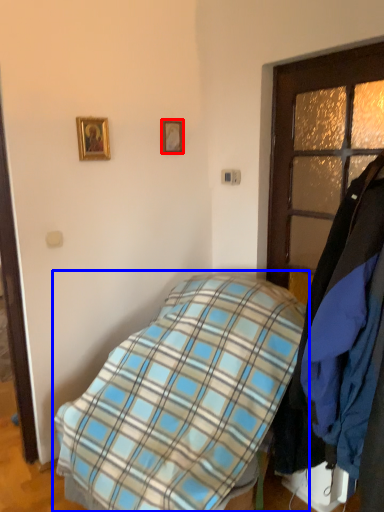
Question: Which object appears closest to the camera in this image, picture frame (highlighted by a red box) or bed (highlighted by a blue box)?

Choices:
 (A) picture frame
 (B) bed

Answer: (B)